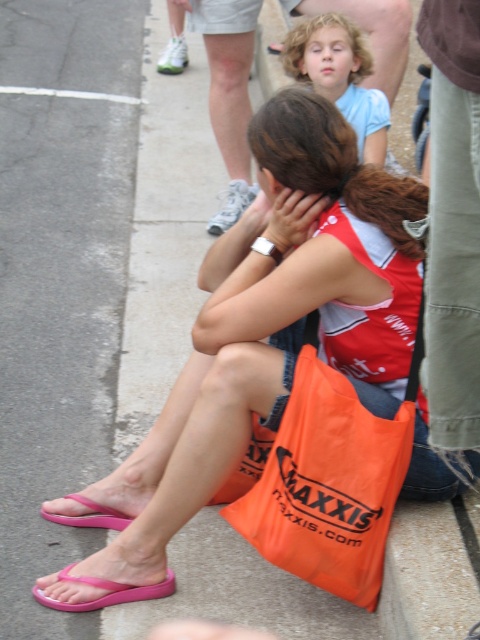
Does light blue fabric shirt at upper center appear on the right side of pink rubber sandal at lower left?

Indeed, light blue fabric shirt at upper center is positioned on the right side of pink rubber sandal at lower left.

Is point (369, 61) behind point (115, 582)?

Yes, it is behind point (115, 582).

What do you see at coordinates (342, 80) in the screenshot? I see `light blue fabric shirt at upper center` at bounding box center [342, 80].

Identify the location of light blue fabric shirt at upper center. (342, 80).

Does orange fabric bag at lower center have a smaller size compared to pink rubber sandal at lower left?

Actually, orange fabric bag at lower center might be larger than pink rubber sandal at lower left.

Consider the image. Who is more distant from viewer, [259,486] or [152,589]?

Point [152,589]

What are the coordinates of `orange fabric bag at lower center` in the screenshot? It's located at (328, 483).

Is orange fabric bag at lower center positioned before pink rubber flip-flop at lower left?

Yes, orange fabric bag at lower center is in front of pink rubber flip-flop at lower left.

This screenshot has height=640, width=480. What do you see at coordinates (328, 483) in the screenshot?
I see `orange fabric bag at lower center` at bounding box center [328, 483].

Is point (311, 499) closer to viewer compared to point (82, 499)?

Yes, it is in front of point (82, 499).

Where is `orange fabric bag at lower center`? The width and height of the screenshot is (480, 640). orange fabric bag at lower center is located at coordinates (328, 483).